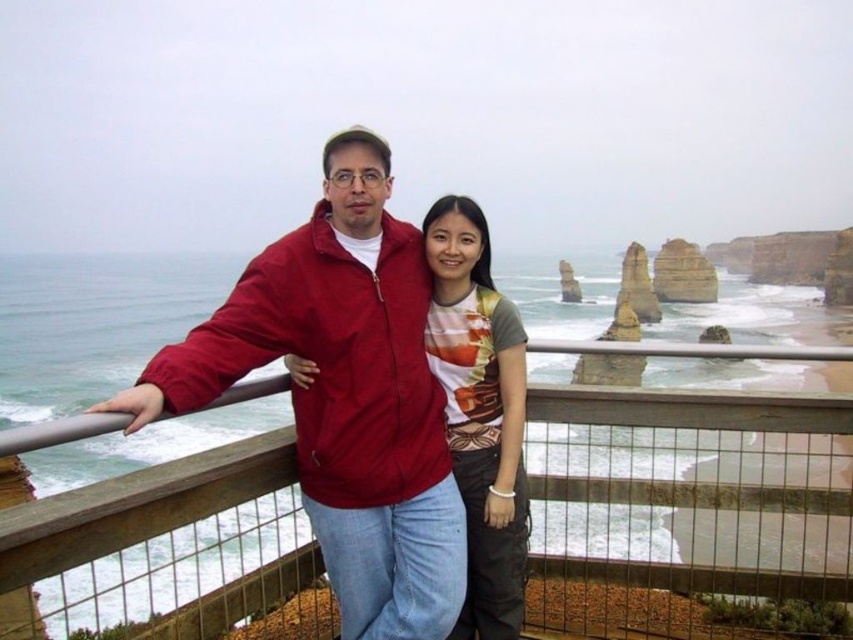
Question: Can you confirm if wooden at center is wider than printed cotton t-shirt at center?

Choices:
 (A) no
 (B) yes

Answer: (B)

Question: Can you confirm if wooden at center is positioned to the left of matte red jacket at center?

Choices:
 (A) yes
 (B) no

Answer: (B)

Question: Does wooden at center appear under printed cotton t-shirt at center?

Choices:
 (A) no
 (B) yes

Answer: (B)

Question: Which is farther from the matte gray t-shirt at center?

Choices:
 (A) wooden at center
 (B) printed cotton t-shirt at center
 (C) matte red jacket at center

Answer: (A)

Question: Based on their relative distances, which object is farther from the wooden at center?

Choices:
 (A) printed cotton t-shirt at center
 (B) matte red jacket at center

Answer: (A)

Question: Among these objects, which one is nearest to the camera?

Choices:
 (A) wooden at center
 (B) printed cotton t-shirt at center
 (C) matte red jacket at center

Answer: (A)